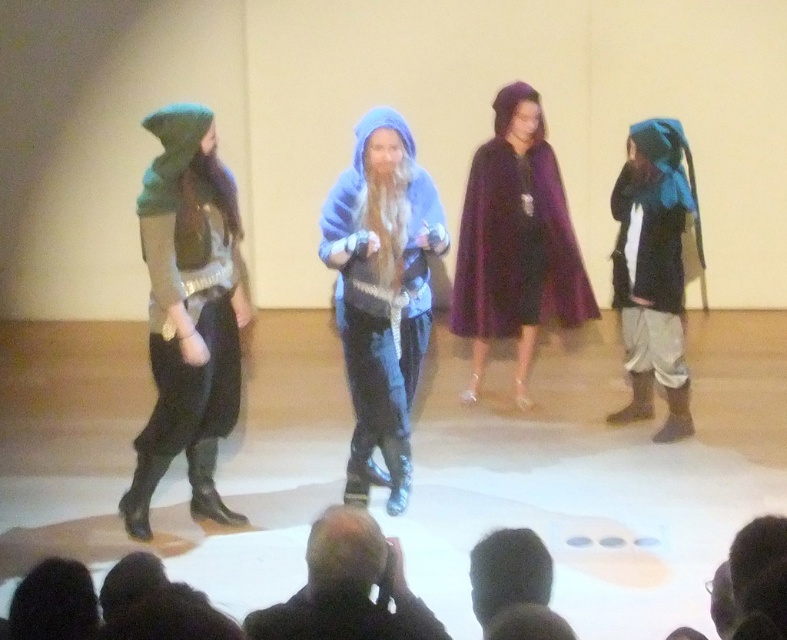
Question: Which point is farther to the camera?

Choices:
 (A) fuzzy blue hoodie at center
 (B) black hair at lower left
 (C) black hair at lower center

Answer: (A)

Question: Considering the relative positions of blue felt hood at right and black fabric hat at lower left in the image provided, where is blue felt hood at right located with respect to black fabric hat at lower left?

Choices:
 (A) right
 (B) left

Answer: (A)

Question: Can you confirm if green fuzzy hood at left is thinner than black leather jacket at lower center?

Choices:
 (A) yes
 (B) no

Answer: (B)

Question: Based on their relative distances, which object is farther from the black leather jacket at lower center?

Choices:
 (A) black hair at lower left
 (B) blue felt hood at right

Answer: (B)

Question: Considering the real-world distances, which object is farthest from the purple velvet cape at center?

Choices:
 (A) black hair at lower left
 (B) fuzzy blue hoodie at center

Answer: (A)

Question: Is green fuzzy hood at left thinner than black leather jacket at lower center?

Choices:
 (A) yes
 (B) no

Answer: (B)